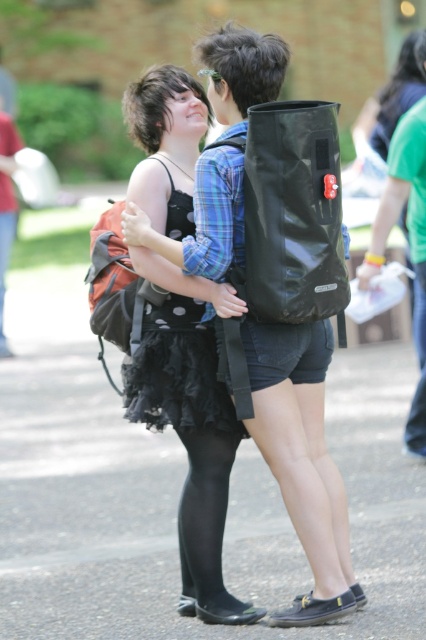
Which is in front, point (170, 352) or point (417, 397)?

Positioned in front is point (170, 352).

Does black tulle skirt at center appear on the right side of denim shorts at lower right?

No, black tulle skirt at center is not to the right of denim shorts at lower right.

Is point (213, 602) positioned behind point (423, 275)?

No.

Image resolution: width=426 pixels, height=640 pixels. I want to click on black tulle skirt at center, so click(x=190, y=428).

Can you confirm if black tulle skirt at center is bigger than black polka dot dress at center?

Correct, black tulle skirt at center is larger in size than black polka dot dress at center.

Which is behind, point (216, 401) or point (187, 312)?

The point (187, 312) is more distant.

Where is `black tulle skirt at center`? This screenshot has width=426, height=640. black tulle skirt at center is located at coordinates (190, 428).

Which is in front, point (316, 288) or point (374, 252)?

Positioned in front is point (316, 288).

Is black matte backpack at center below green fabric shirt at upper right?

No.

Is point (284, 147) behind point (382, 220)?

No, it is not.

Locate an element on the screen. This screenshot has height=640, width=426. black matte backpack at center is located at coordinates (293, 212).